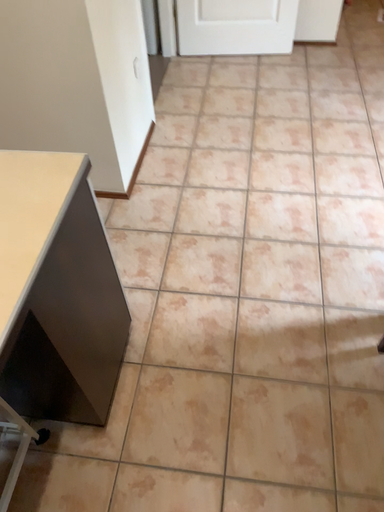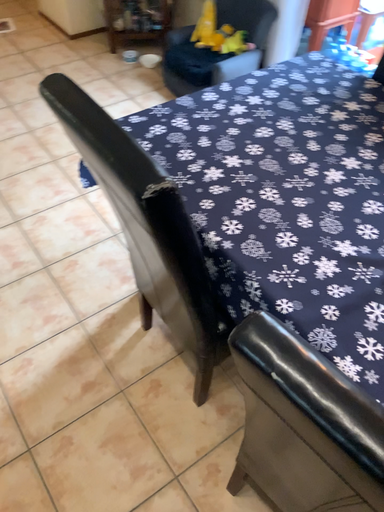
Question: How did the camera likely rotate when shooting the video?

Choices:
 (A) rotated right
 (B) rotated left

Answer: (A)